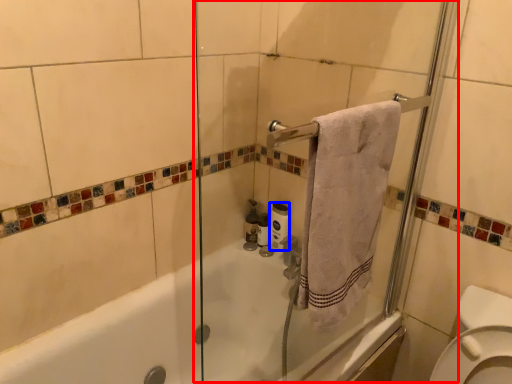
Question: Which object is further to the camera taking this photo, screen door (highlighted by a red box) or toilet paper (highlighted by a blue box)?

Choices:
 (A) screen door
 (B) toilet paper

Answer: (B)